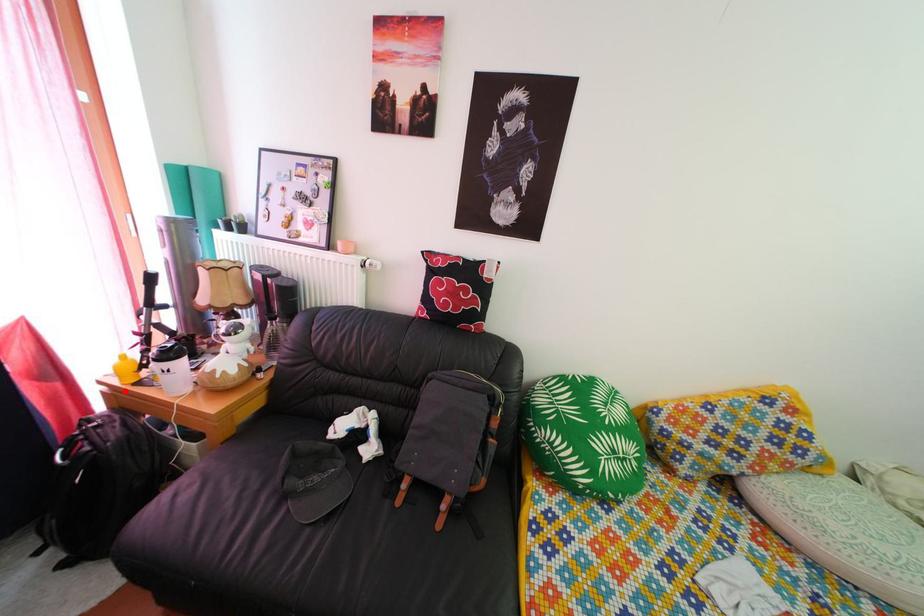
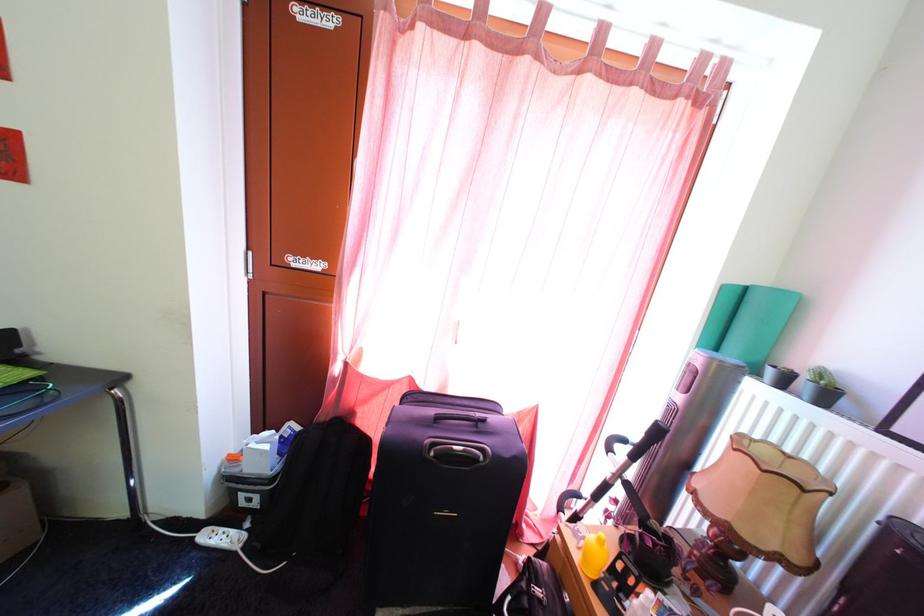
Question: I am providing you with two images of the same scene from different viewpoints. In image1, a red point is highlighted. Considering the same 3D point in image2, which of the following is correct?

Choices:
 (A) It is closer
 (B) It is farther

Answer: (B)